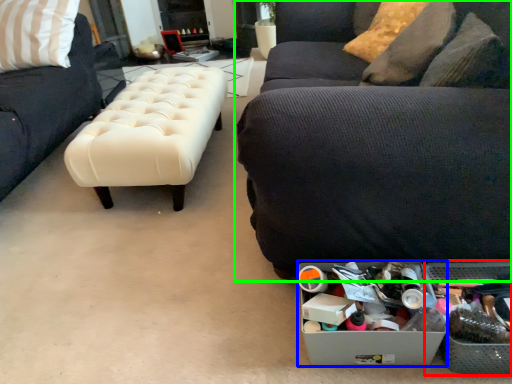
Question: Which object is positioned closest to storage box (highlighted by a red box)? Select from storage box (highlighted by a blue box) and studio couch (highlighted by a green box).

Choices:
 (A) storage box
 (B) studio couch

Answer: (A)